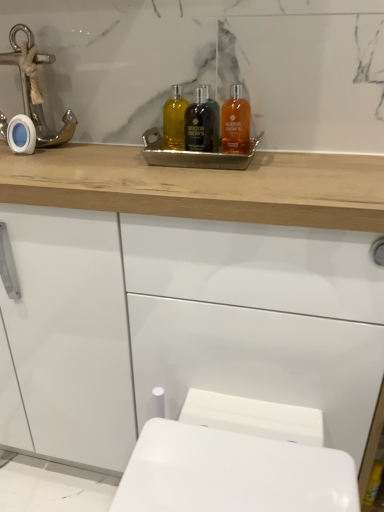
Locate an element on the screen. This screenshot has width=384, height=512. vacant space to the right of metallic tray at center is located at coordinates (314, 159).